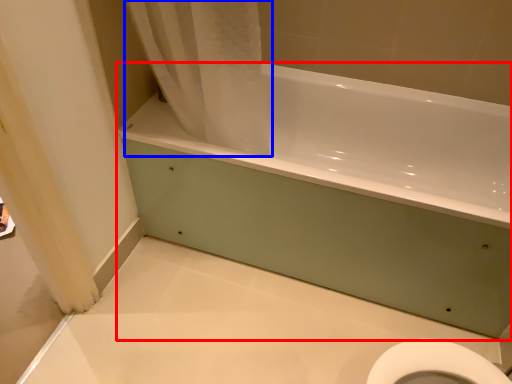
Question: Among these objects, which one is farthest to the camera, bathtub (highlighted by a red box) or shower curtain (highlighted by a blue box)?

Choices:
 (A) bathtub
 (B) shower curtain

Answer: (A)